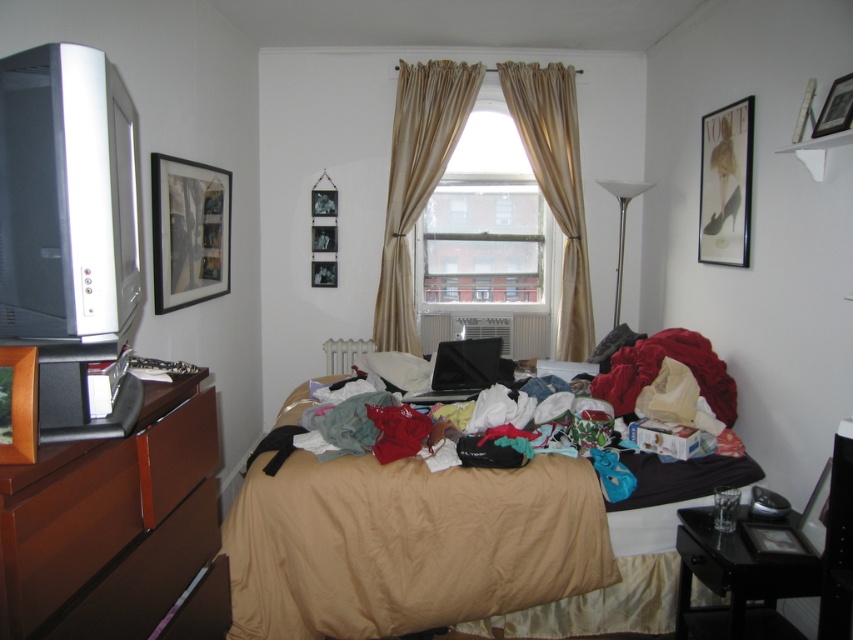
Question: Which point is farther to the camera?

Choices:
 (A) (746, 234)
 (B) (514, 81)

Answer: (B)

Question: Is multicolored fabric bed at center smaller than metallic silver picture frame at upper right?

Choices:
 (A) no
 (B) yes

Answer: (A)

Question: Which of the following is the closest to the observer?

Choices:
 (A) (793, 138)
 (B) (334, 244)
 (C) (824, 497)
 (D) (402, 109)

Answer: (C)

Question: Does beige silk curtains at upper center have a greater width compared to multicolored fabric at center?

Choices:
 (A) no
 (B) yes

Answer: (B)

Question: Is metallic silver picture frame at lower right below metallic silver picture frame at upper center?

Choices:
 (A) no
 (B) yes

Answer: (B)

Question: Estimate the real-world distances between objects in this image. Which object is farther from the multicolored fabric bed at center?

Choices:
 (A) black matte laptop at center
 (B) matte black picture frame at upper left
 (C) metallic silver picture frame at lower right

Answer: (B)